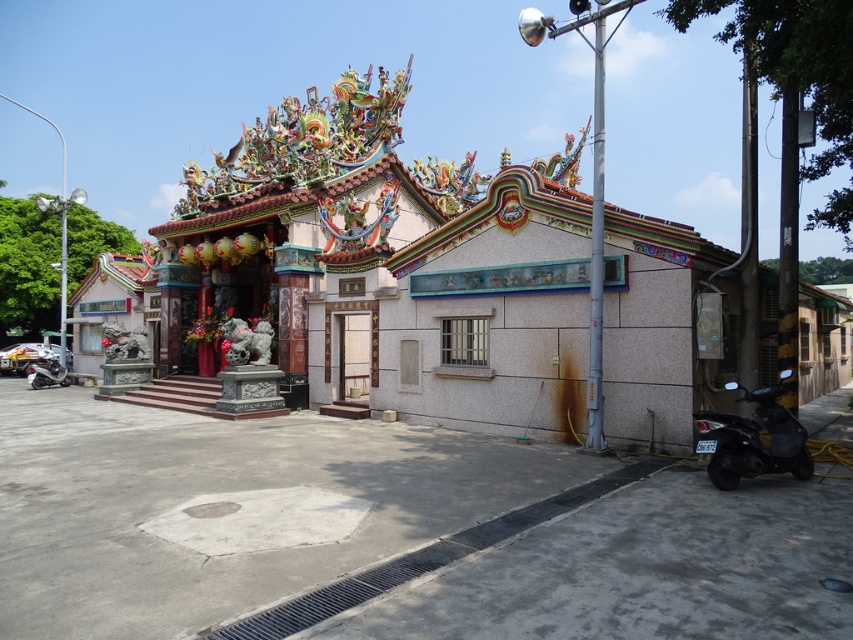
You are a visitor at this traditional Chinese building and want to park your motorcycle. You see a black matte motorcycle at lower right and a shiny silver motorcycle at lower left. Which motorcycle is smaller in size?

The black matte motorcycle at lower right has a smaller size compared to the shiny silver motorcycle at lower left, so the black matte motorcycle at lower right is smaller.

You are standing in front of the traditional Chinese building and want to enter through the entrance. Where should you walk towards to find the white stone door at center?

You should walk towards the point at coordinates 0.553 on the horizontal axis and 0.417 on the vertical axis to find the white stone door at center.

From the picture: You are standing in front of the traditional Chinese building and want to take a photo. There are two points marked on the building, point (x=708, y=432) and point (x=364, y=394). Which point is closer to your camera when taking the photo?

Point (x=708, y=432) is closer to the camera than point (x=364, y=394).